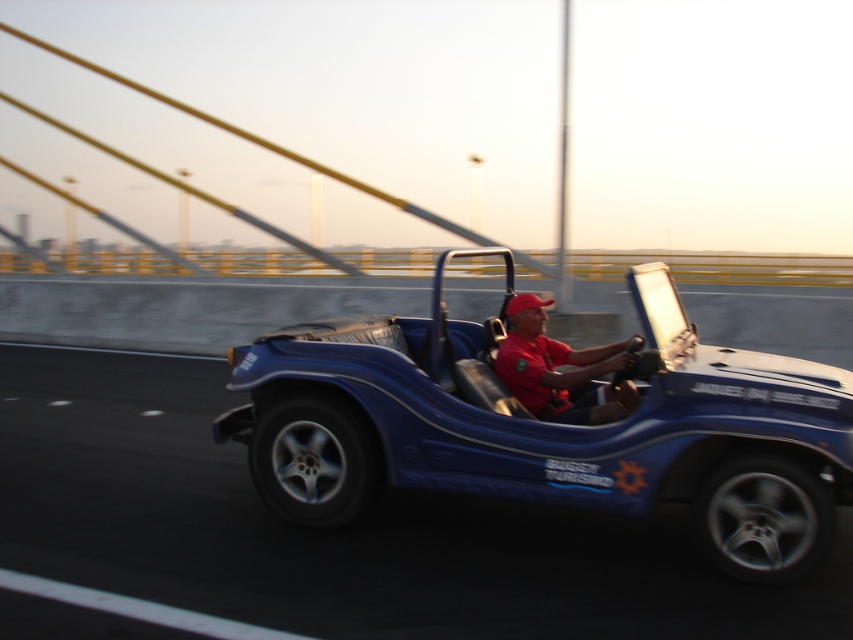
You are a photographer trying to capture the blue matte buggy at center and the red matte shirt at center in the same frame. Which object will appear bigger in the photo?

The blue matte buggy at center will appear bigger in the photo because it has a larger size compared to the red matte shirt at center.

You are standing at the origin point of the image. A blue matte buggy at center is located at coordinates point (550, 428). If you want to reach the blue matte buggy at center, which direction should you move in? Please provide your answer in terms of the coordinate system where the origin is at the bottom left corner of the image, with the x and y axes increasing to the right and up respectively.

To reach the blue matte buggy at center located at point (550, 428) from the origin at the bottom left corner, you should move to the right along the x axis and upwards along the y axis since the coordinates are positive in both directions.

You are standing on the bridge and see the blue matte buggy at center and the red matte shirt at center. Which object is nearer to you?

The blue matte buggy at center is closer to the viewer than the red matte shirt at center.